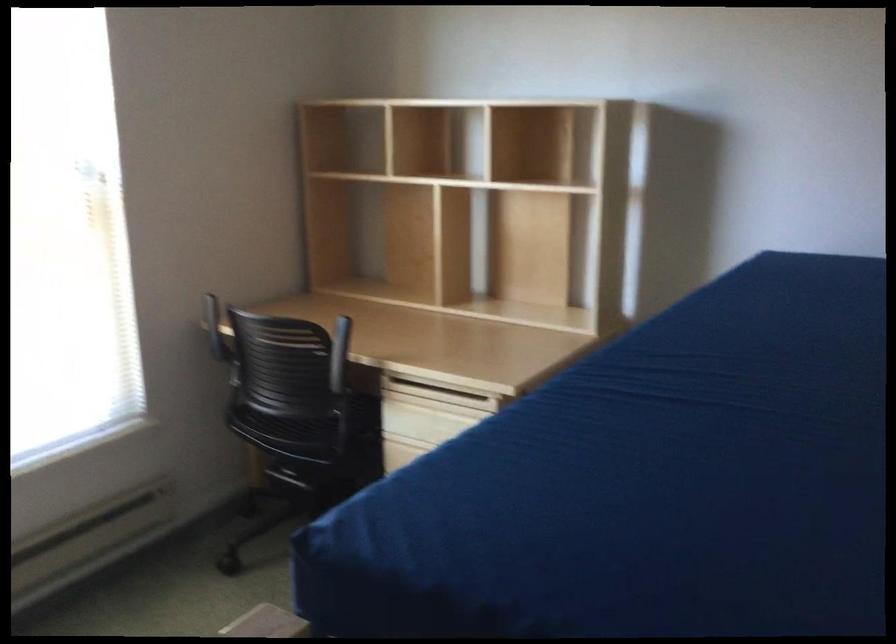
Where is `black chair sitting surface`? The image size is (896, 644). black chair sitting surface is located at coordinates (283, 424).